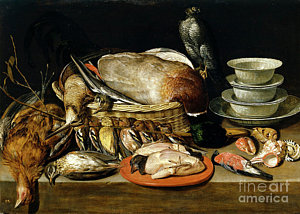
This screenshot has width=300, height=214. What are the coordinates of `table` in the screenshot? It's located at (224, 176).